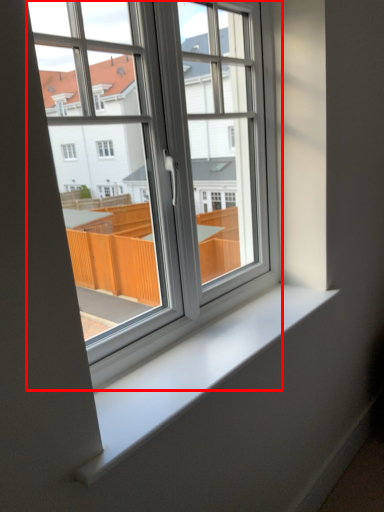
Question: Observing the image, what is the correct spatial positioning of window (annotated by the red box) in reference to window sill?

Choices:
 (A) left
 (B) right

Answer: (A)